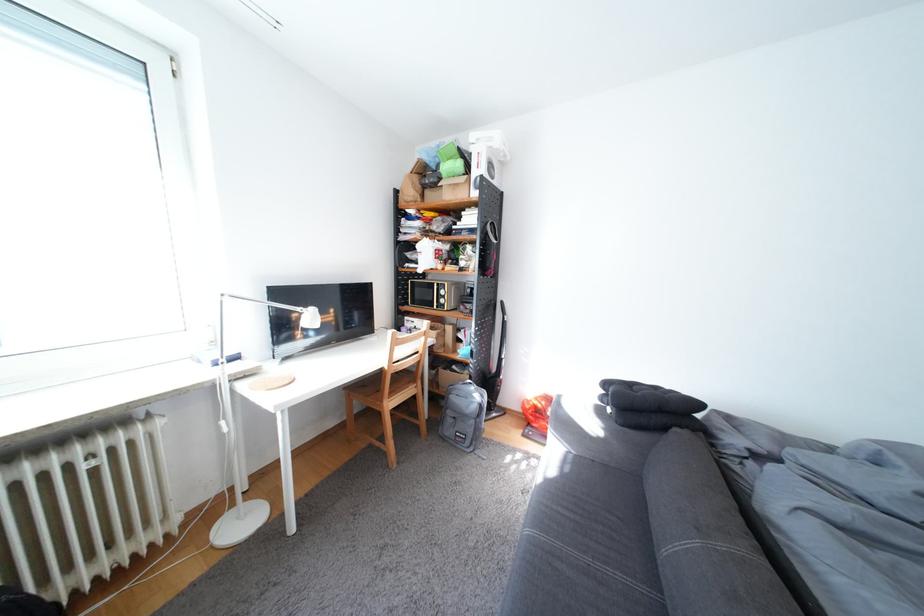
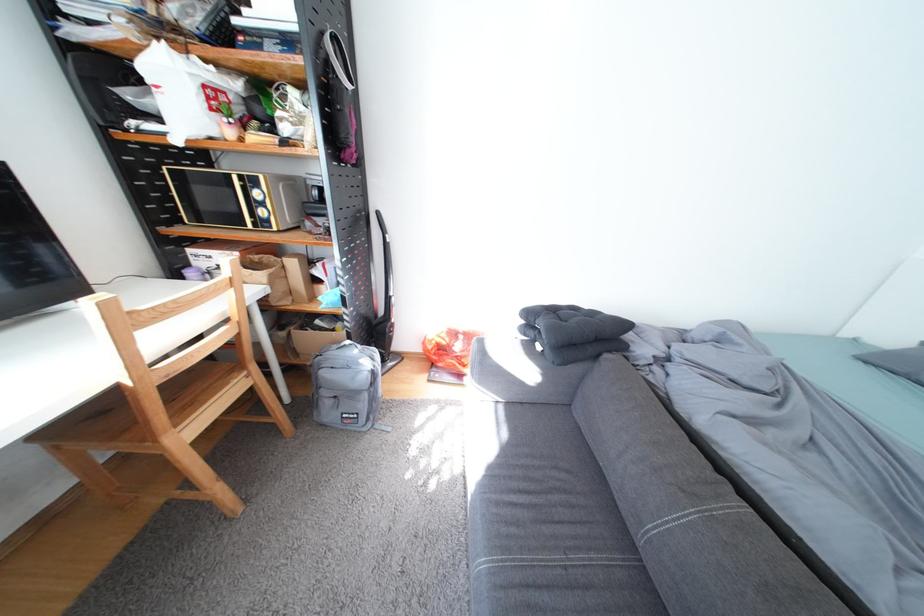
Based on the continuous images, in which direction is the camera rotating?

The camera rotated toward right-down.